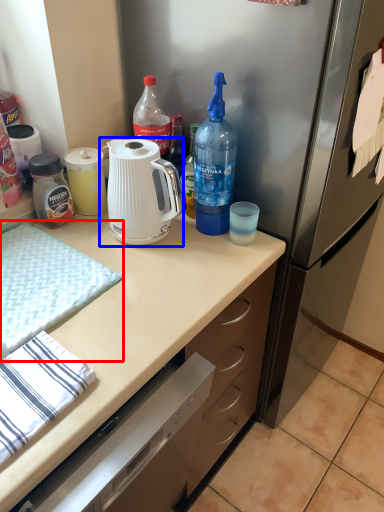
Question: Which object appears closest to the camera in this image, hand towel (highlighted by a red box) or kettle (highlighted by a blue box)?

Choices:
 (A) hand towel
 (B) kettle

Answer: (A)